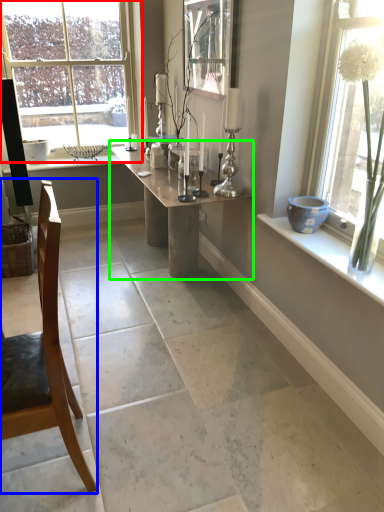
Question: Considering the real-world distances, which object is farthest from window (highlighted by a red box)? chair (highlighted by a blue box) or table (highlighted by a green box)?

Choices:
 (A) chair
 (B) table

Answer: (A)